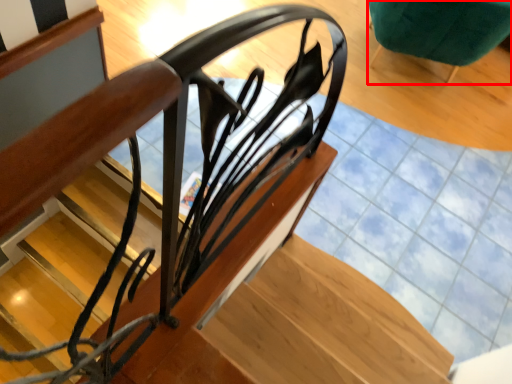
Question: From the image, what is the correct spatial relationship of furniture (annotated by the red box) in relation to stairs?

Choices:
 (A) left
 (B) right

Answer: (B)